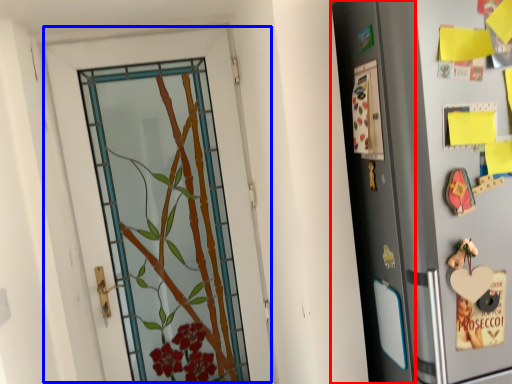
Question: Among these objects, which one is nearest to the camera, screen door (highlighted by a red box) or door (highlighted by a blue box)?

Choices:
 (A) screen door
 (B) door

Answer: (A)